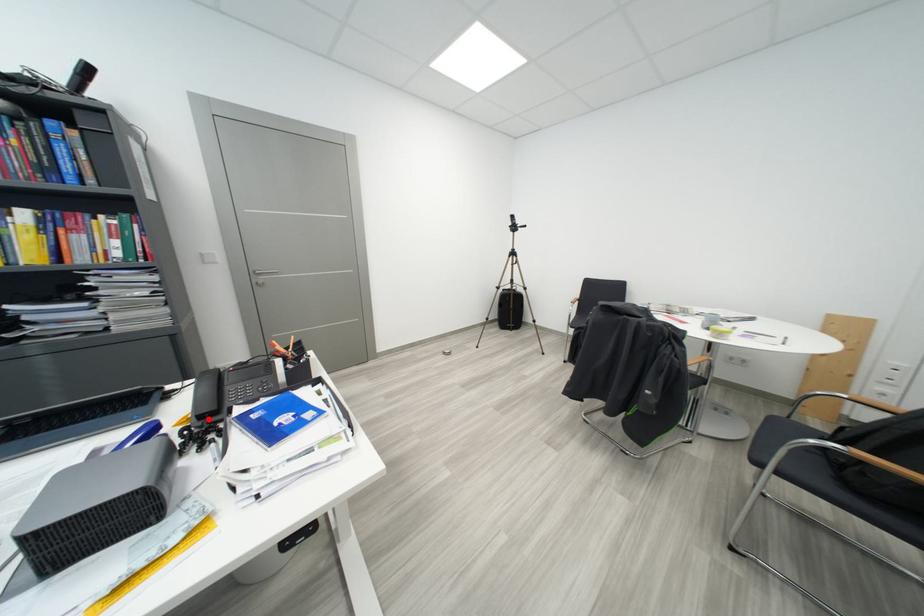
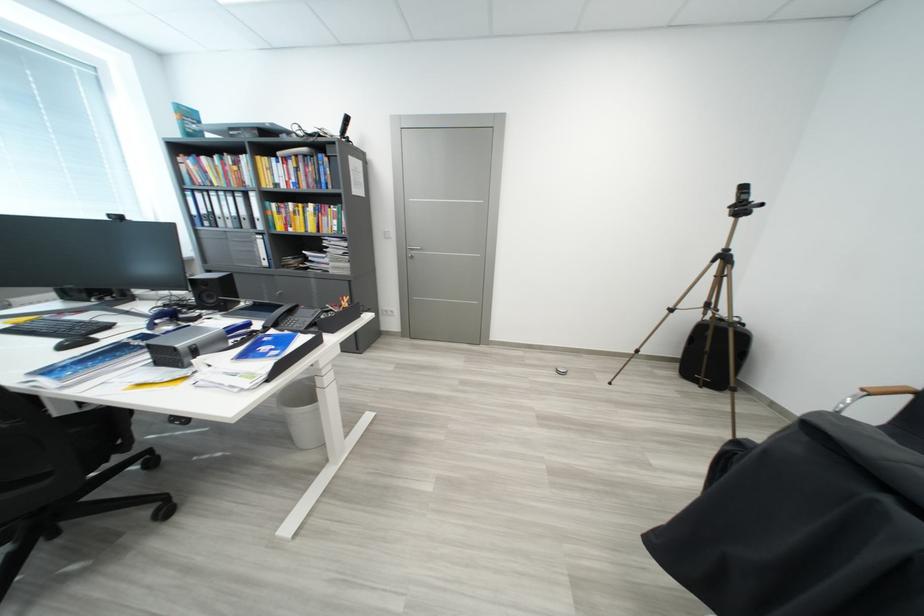
Locate, in the second image, the point that corresponds to the highlighted location in the first image.

(274, 330)